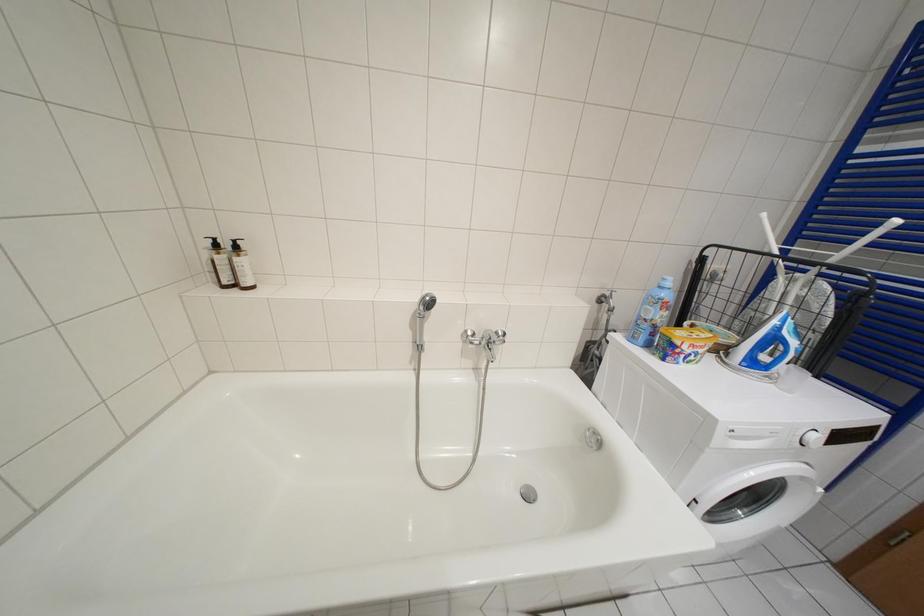
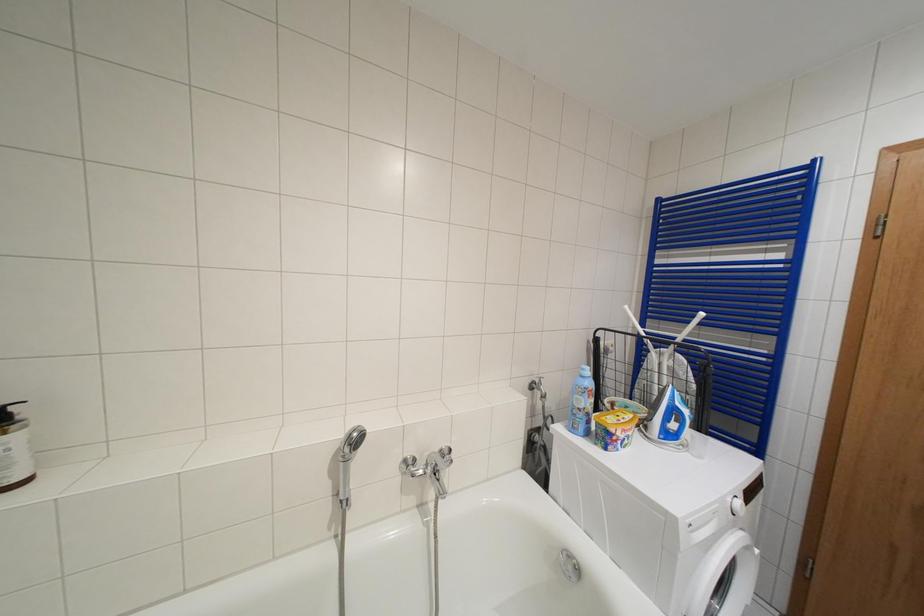
What movement of the cameraman would produce the second image?

The cameraman walked toward left, forward.